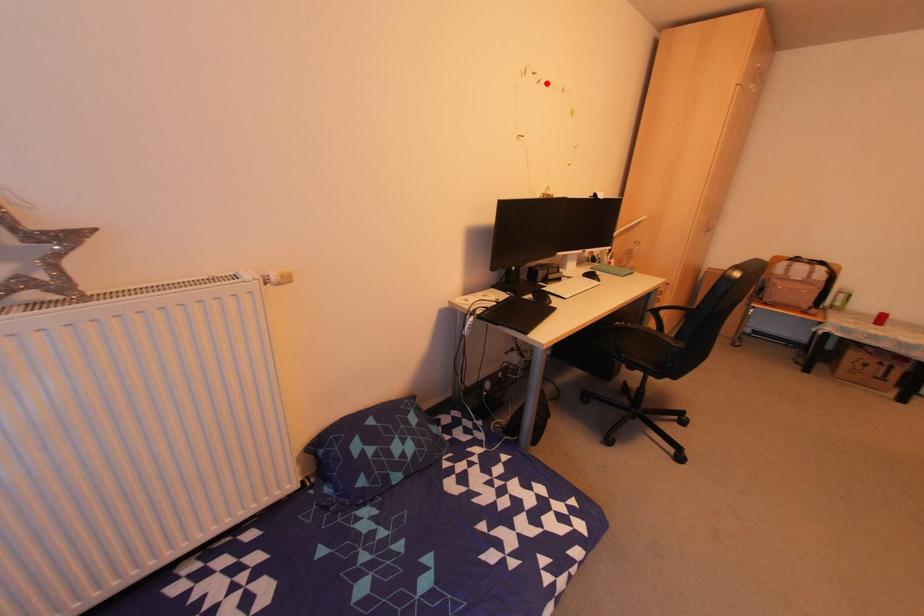
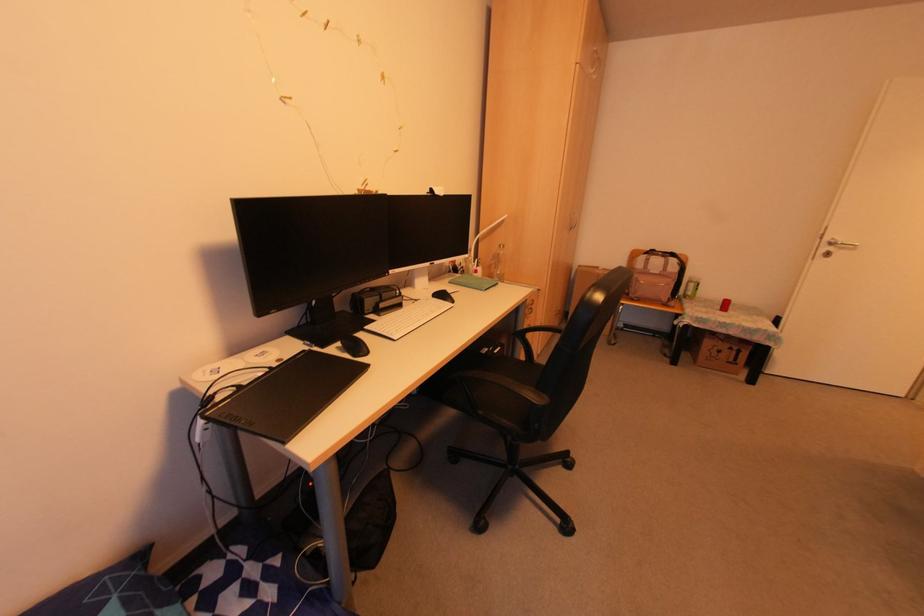
The point at the highlighted location is marked in the first image. Where is the corresponding point in the second image?

(324, 22)